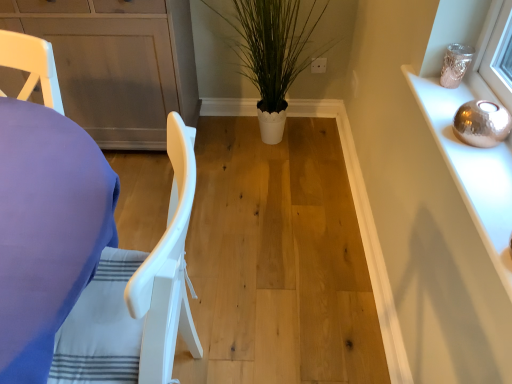
Identify the location of free space above silver metallic sphere at upper right, the 2th cabinetry when ordered from left to right (from a real-world perspective). The width and height of the screenshot is (512, 384). (466, 142).